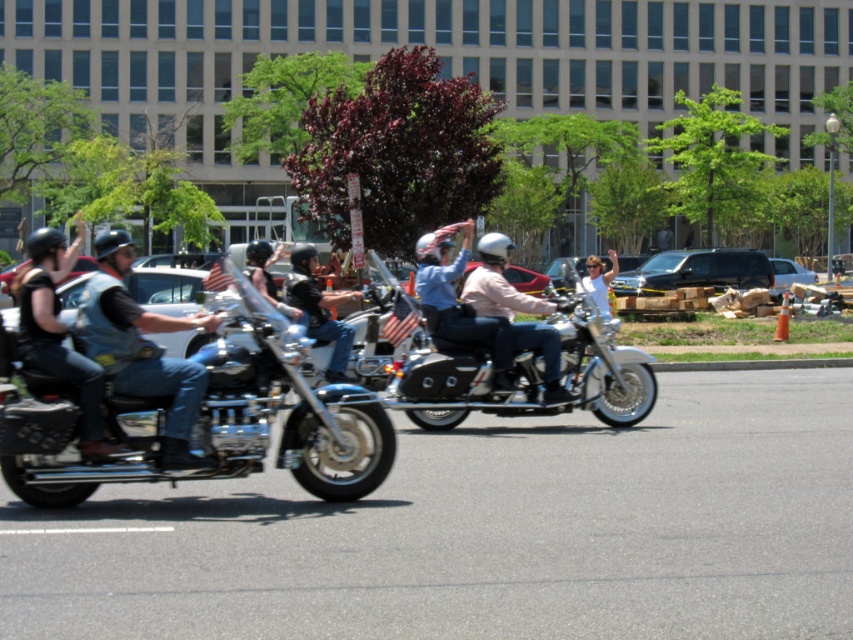
You are a photographer standing on the sidewalk observing the shiny chrome motorcycle at left and the matte black motorcycle at left. Which motorcycle would appear shorter in your photo?

The shiny chrome motorcycle at left is not as tall as the matte black motorcycle at left, so it would appear shorter in the photo.

From the picture: You are standing at the origin point of the coordinate system. A shiny chrome motorcycle at left is located at point (199, 419). If you want to move towards the shiny chrome motorcycle at left, which direction should you go?

The shiny chrome motorcycle at left is located at point (199, 419), so you should move towards the right and forward direction since the x and y coordinates are both positive compared to the origin.

You are a photographer trying to capture both the shiny chrome motorcycle at left and the matte black motorcycle at left in a single frame. Given that your camera can only accommodate objects up to 2 meters in width, will both motorcycles fit if they are placed side by side?

The shiny chrome motorcycle at left has a lesser width compared to matte black motorcycle at left. Since the total width of both motorcycles combined would be the sum of their individual widths, but the camera can only accommodate up to 2 meters, it depends on their exact measurements. However, since the matte black motorcycle is wider, if its width alone exceeds 2 meters, they won